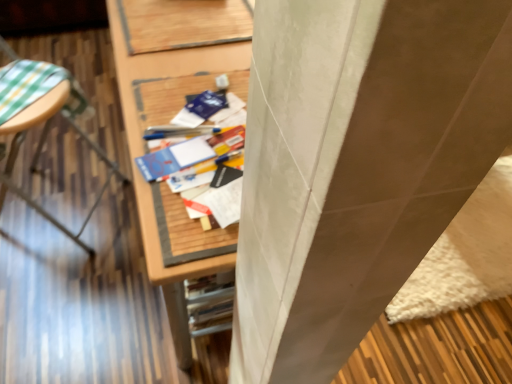
Question: Does wooden desk at center, which is counted as the first furniture, starting from the right, have a smaller size compared to matte blue paperback book at center, the 2th paperback book positioned from the top?

Choices:
 (A) yes
 (B) no

Answer: (B)

Question: Can you confirm if wooden desk at center, which is counted as the first furniture, starting from the right, is bigger than matte blue paperback book at center, arranged as the 1th paperback book when ordered from the bottom?

Choices:
 (A) yes
 (B) no

Answer: (A)

Question: Considering the relative sizes of wooden desk at center, acting as the 2th furniture starting from the left, and matte blue paperback book at center, arranged as the 1th paperback book when ordered from the bottom, in the image provided, is wooden desk at center, acting as the 2th furniture starting from the left, wider than matte blue paperback book at center, arranged as the 1th paperback book when ordered from the bottom,?

Choices:
 (A) no
 (B) yes

Answer: (B)

Question: Is wooden desk at center, acting as the 2th furniture starting from the left, surrounding matte blue paperback book at center, acting as the 2th paperback book starting from the back?

Choices:
 (A) no
 (B) yes

Answer: (A)

Question: From the image's perspective, does wooden desk at center, acting as the 2th furniture starting from the left, appear higher than matte blue paperback book at center, the 2th paperback book positioned from the top?

Choices:
 (A) yes
 (B) no

Answer: (A)

Question: From a real-world perspective, is matte blue paperback book at center, acting as the 2th paperback book starting from the back, above or below blue matte paper at center, which appears as the 1th paperback book when viewed from the top?

Choices:
 (A) above
 (B) below

Answer: (B)

Question: Looking at their shapes, would you say matte blue paperback book at center, arranged as the 1th paperback book when ordered from the bottom, is wider or thinner than blue matte paper at center, arranged as the second paperback book when ordered from the bottom?

Choices:
 (A) thin
 (B) wide

Answer: (B)

Question: Looking at the image, does matte blue paperback book at center, arranged as the 1th paperback book when ordered from the bottom, seem bigger or smaller compared to blue matte paper at center, which ranks as the 2th paperback book in front-to-back order?

Choices:
 (A) small
 (B) big

Answer: (B)

Question: From the image's perspective, is matte blue paperback book at center, which appears as the 1th paperback book when viewed from the front, positioned above or below blue matte paper at center, arranged as the second paperback book when ordered from the bottom?

Choices:
 (A) below
 (B) above

Answer: (A)

Question: Considering their positions, is wooden desk at center, which is counted as the first furniture, starting from the right, located in front of or behind matte blue paperback book at center, arranged as the 1th paperback book when ordered from the bottom?

Choices:
 (A) behind
 (B) front

Answer: (B)

Question: Based on their positions, is wooden desk at center, acting as the 2th furniture starting from the left, located to the left or right of matte blue paperback book at center, the 2th paperback book positioned from the top?

Choices:
 (A) left
 (B) right

Answer: (B)

Question: From the image's perspective, is wooden desk at center, which is counted as the first furniture, starting from the right, above or below matte blue paperback book at center, arranged as the 1th paperback book when ordered from the bottom?

Choices:
 (A) below
 (B) above

Answer: (B)

Question: Is wooden desk at center, which is counted as the first furniture, starting from the right, inside or outside of matte blue paperback book at center, which appears as the 1th paperback book when viewed from the front?

Choices:
 (A) outside
 (B) inside

Answer: (A)

Question: From the image's perspective, is matte blue paperback book at center, which appears as the 1th paperback book when viewed from the front, positioned above or below wooden table at left, which is the second furniture from right to left?

Choices:
 (A) below
 (B) above

Answer: (A)

Question: Is matte blue paperback book at center, which appears as the 1th paperback book when viewed from the front, to the left or to the right of wooden table at left, which is the second furniture from right to left, in the image?

Choices:
 (A) right
 (B) left

Answer: (A)